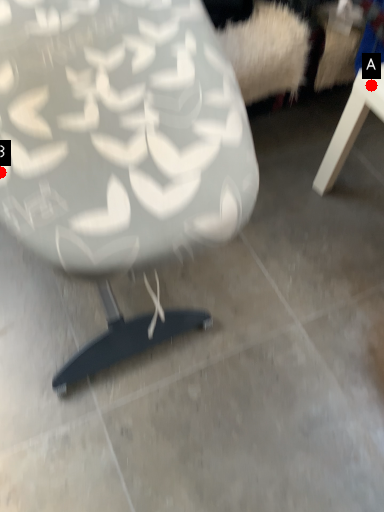
Question: Two points are circled on the image, labeled by A and B beside each circle. Which point is closer to the camera?

Choices:
 (A) A is closer
 (B) B is closer

Answer: (B)